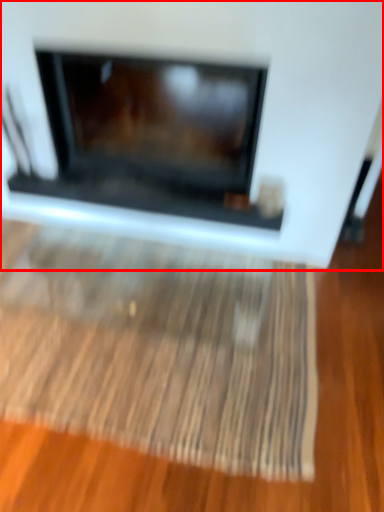
Question: Considering the relative positions of fireplace (annotated by the red box) and mat in the image provided, where is fireplace (annotated by the red box) located with respect to the staircase?

Choices:
 (A) right
 (B) left

Answer: (A)